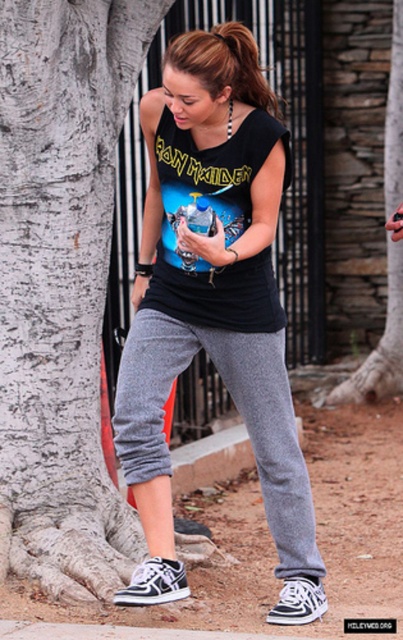
Question: Which point appears closest to the camera in this image?

Choices:
 (A) (330, 230)
 (B) (166, 272)
 (C) (8, 138)
 (D) (236, 397)

Answer: (B)

Question: Does black cotton tank top at center appear on the left side of matte black tank top at center?

Choices:
 (A) no
 (B) yes

Answer: (B)

Question: Does black cotton tank top at center have a smaller size compared to gray bark tree trunk at right?

Choices:
 (A) yes
 (B) no

Answer: (B)

Question: Among these points, which one is farthest from the camera?

Choices:
 (A) (398, 316)
 (B) (157, 492)

Answer: (A)

Question: Which object appears farthest from the camera in this image?

Choices:
 (A) black cotton tank top at center
 (B) gray bark tree trunk at right
 (C) gray bark tree at left

Answer: (B)

Question: Observing the image, what is the correct spatial positioning of gray bark tree at left in reference to matte black tank top at center?

Choices:
 (A) left
 (B) right

Answer: (A)